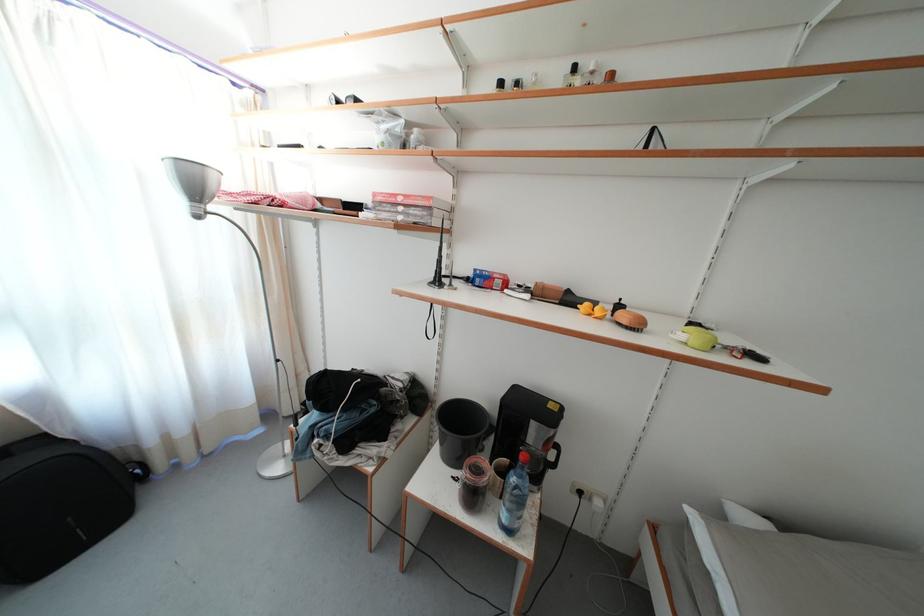
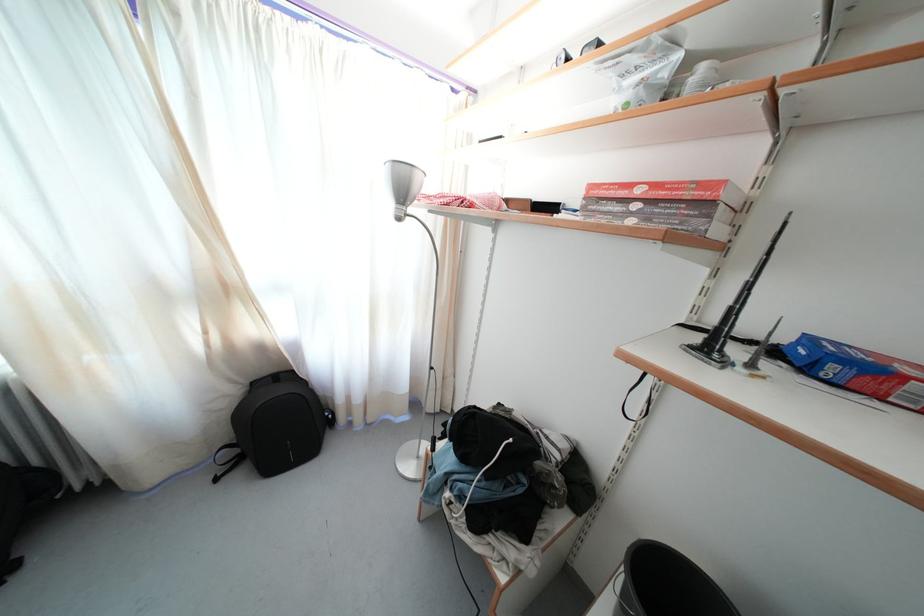
Where in the second image is the point corresponding to [483,286] from the first image?

(839, 374)